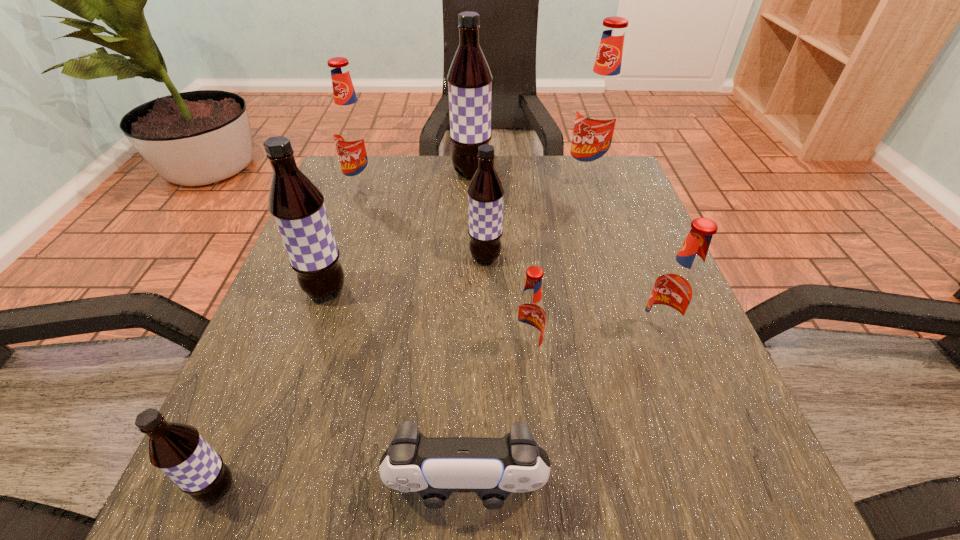
Find the location of `vacant space at the near right corner of the desktop`. vacant space at the near right corner of the desktop is located at coordinates (721, 462).

Find the location of `free space between the shortest object and the second smallest red root beer`. free space between the shortest object and the second smallest red root beer is located at coordinates (562, 414).

Where is `free space between the second biggest brown root beer and the second smallest red root beer`? The width and height of the screenshot is (960, 540). free space between the second biggest brown root beer and the second smallest red root beer is located at coordinates (492, 314).

Where is `unoccupied position between the leftmost red root beer and the smallest brown root beer`? The height and width of the screenshot is (540, 960). unoccupied position between the leftmost red root beer and the smallest brown root beer is located at coordinates (291, 339).

You are a GUI agent. You are given a task and a screenshot of the screen. Output one action in this format:
    pyautogui.click(x=<x>, y=<y>)
    Task: Click on the vacant space that is in between the control and the sixth root beer from left to right
    
    Given the screenshot: What is the action you would take?
    pyautogui.click(x=496, y=421)

Find the location of `free point between the smallest brown root beer and the third biggest red root beer`. free point between the smallest brown root beer and the third biggest red root beer is located at coordinates (437, 413).

This screenshot has width=960, height=540. Identify the location of empty space between the shortest object and the third farthest brown root beer. (396, 390).

The width and height of the screenshot is (960, 540). Identify the location of free space between the farthest brown root beer and the nearest root beer. (345, 330).

Locate an element on the screen. The width and height of the screenshot is (960, 540). blank region between the biggest brown root beer and the nearest root beer is located at coordinates (345, 330).

Locate which object ranks fourth in proximity to the leftmost red root beer. Please provide its 2D coordinates. Your answer should be formatted as a tuple, i.e. [(x, y)], where the tuple contains the x and y coordinates of a point satisfying the conditions above.

[(598, 115)]